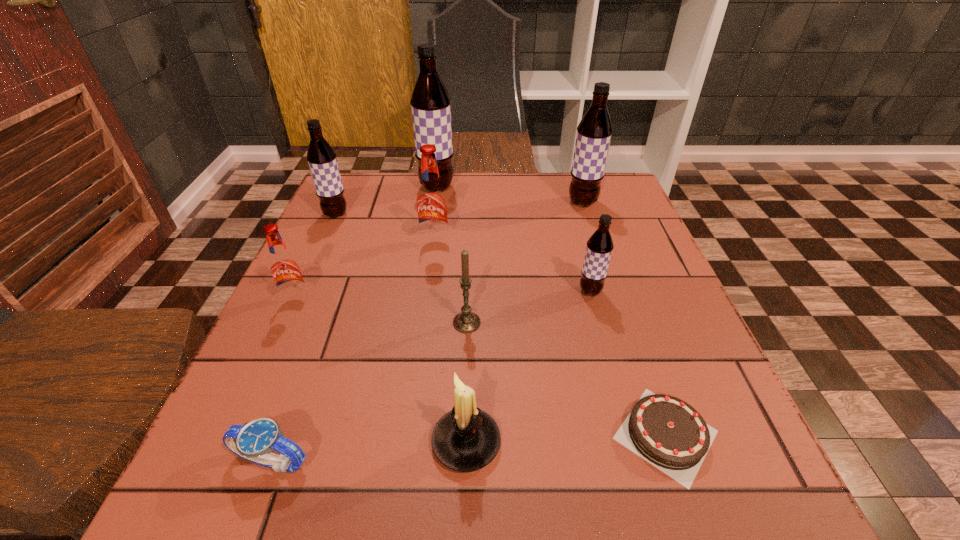
I want to click on vacant region located on the back of the third biggest brown root beer, so click(345, 195).

Locate an element on the screen. This screenshot has width=960, height=540. vacant space located on the right of the left red root beer is located at coordinates (465, 301).

You are a GUI agent. You are given a task and a screenshot of the screen. Output one action in this format:
    pyautogui.click(x=<x>, y=<y>)
    Task: Click on the vacant position located on the left of the smallest brown root beer
    The image size is (960, 540).
    Given the screenshot: What is the action you would take?
    pyautogui.click(x=553, y=291)

You are a GUI agent. You are given a task and a screenshot of the screen. Output one action in this format:
    pyautogui.click(x=<x>, y=<y>)
    Task: Click on the vacant point located on the right of the candle
    
    Given the screenshot: What is the action you would take?
    coord(555,322)

Find the location of a particular element. free space located on the left of the white candle holder is located at coordinates (330, 442).

Where is `free spot located 0.110m on the back of the second shortest object`? The image size is (960, 540). free spot located 0.110m on the back of the second shortest object is located at coordinates (301, 381).

Identify the location of vacant space located 0.170m on the back of the brown chocolate cake. (625, 314).

Locate an element on the screen. candle holder that is at the near edge is located at coordinates (465, 439).

Identify the location of watch that is positioned at the near edge. The height and width of the screenshot is (540, 960). (254, 441).

Find the location of `chocolate cake that is at the near edge`. chocolate cake that is at the near edge is located at coordinates (667, 432).